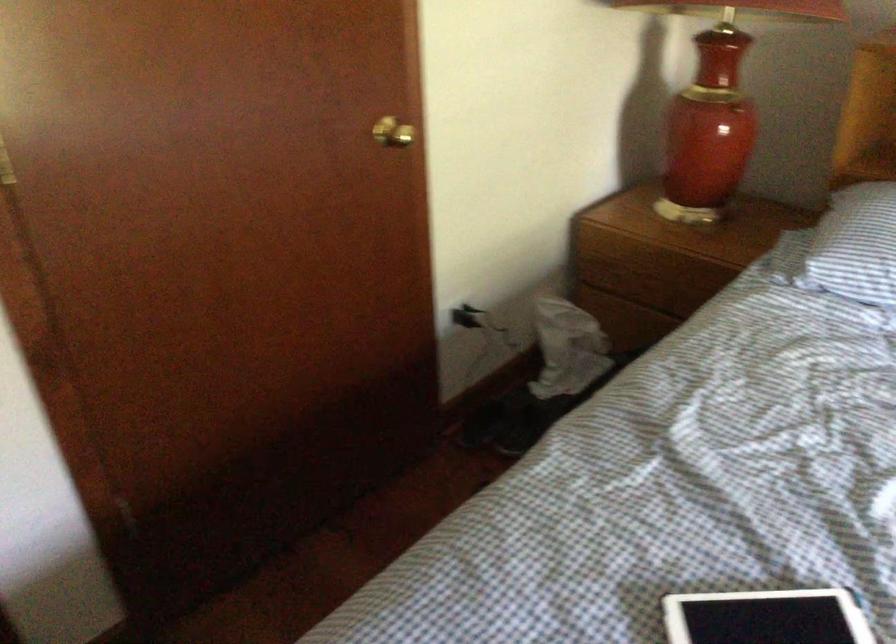
The image size is (896, 644). Identify the location of nightstand drawer pull. (650, 283).